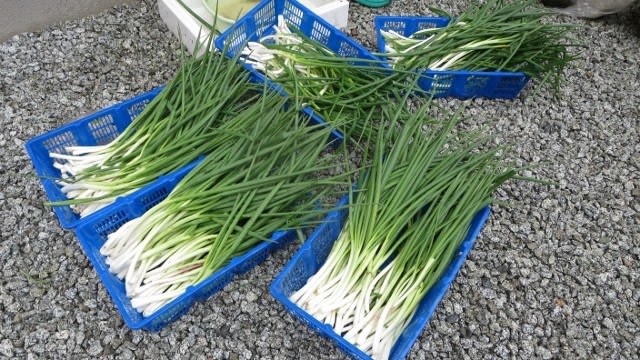
In order to click on blue bin in this screenshot , I will do `click(105, 120)`, `click(114, 213)`, `click(308, 266)`, `click(312, 30)`, `click(402, 29)`.